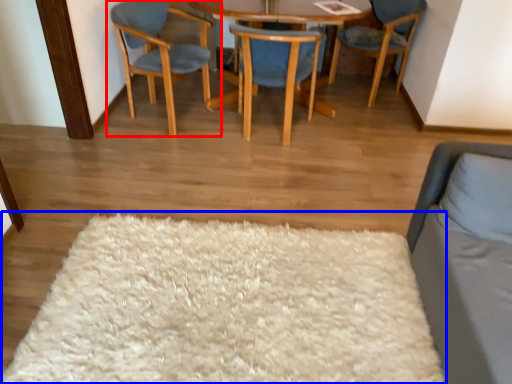
Question: Which object is further to the camera taking this photo, chair (highlighted by a red box) or mat (highlighted by a blue box)?

Choices:
 (A) chair
 (B) mat

Answer: (A)